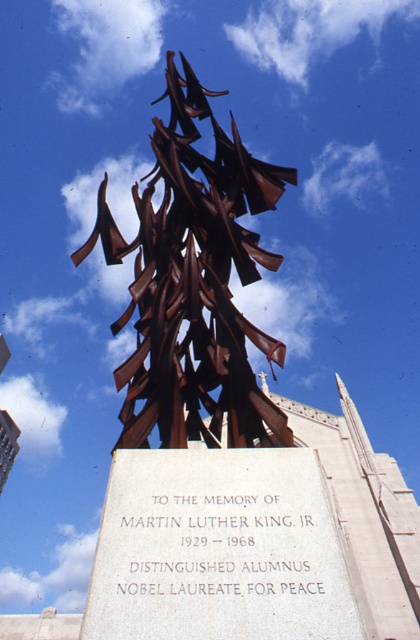
You are an artist planning to create a miniature model of the sculpture and its pedestal. You need to ensure that the scale of the white stone plaque at center and the rusty metal sculpture at center is accurate. Based on the information provided, which object should be smaller in your model?

The white stone plaque at center should be smaller in the model since it occupies less space than the rusty metal sculpture at center according to the description.

You are a tour guide leading a group to the sculpture. You want to inform your group about the distance between the white stone plaque at center and the rusty metal sculpture at center. What do you tell them?

The distance between the white stone plaque at center and the rusty metal sculpture at center is 96.61 feet.